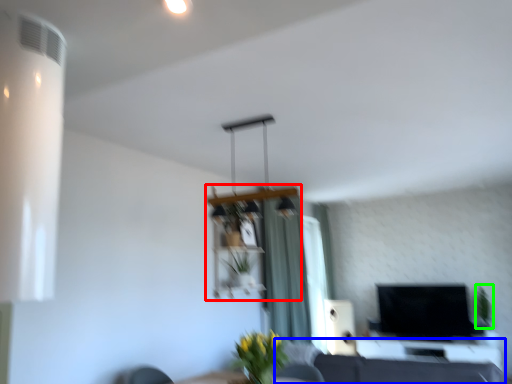
Question: Which is nearer to the shelf (highlighted by a red box)? couch (highlighted by a blue box) or plant (highlighted by a green box).

Choices:
 (A) couch
 (B) plant

Answer: (A)